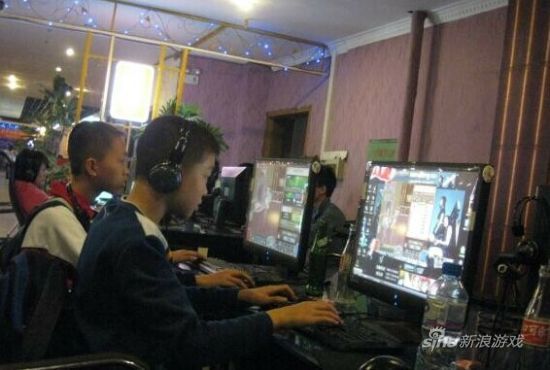
Where is `bottles`? bottles is located at coordinates (537, 325), (440, 311), (344, 263), (316, 260).